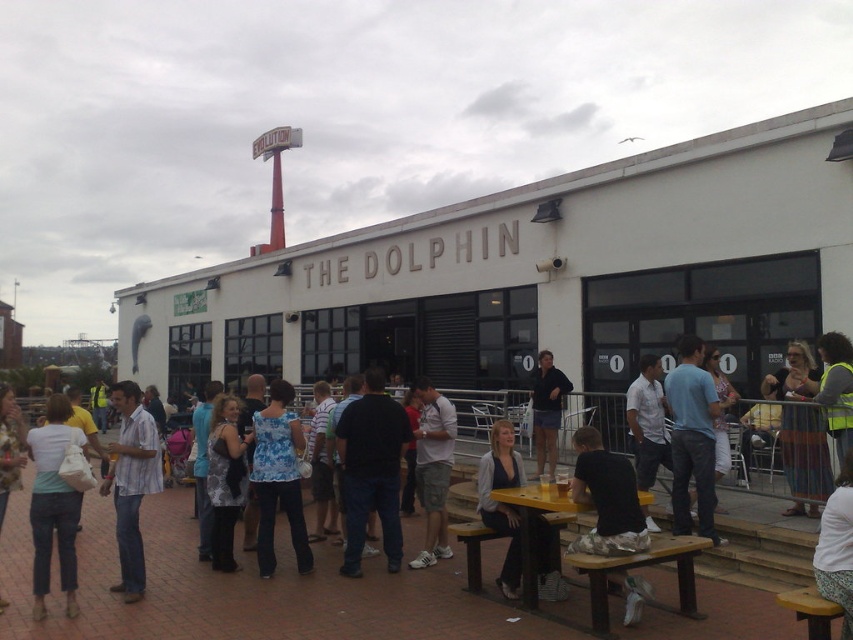
Question: Among these points, which one is nearest to the camera?

Choices:
 (A) (120, 400)
 (B) (514, 531)
 (C) (438, 476)
 (D) (238, 464)

Answer: (B)

Question: Considering the relative positions of dark blue jeans at center and blue cotton shirt at center in the image provided, where is dark blue jeans at center located with respect to blue cotton shirt at center?

Choices:
 (A) left
 (B) right

Answer: (A)

Question: Does white fabric skirt at lower right have a lesser width compared to denim jacket at lower left?

Choices:
 (A) no
 (B) yes

Answer: (B)

Question: Which point appears closest to the camera in this image?

Choices:
 (A) click(x=422, y=384)
 (B) click(x=494, y=493)

Answer: (B)

Question: Which of these objects is positioned closest to the blue printed blouse at center?

Choices:
 (A) wooden picnic table at lower center
 (B) white fabric skirt at lower right

Answer: (A)

Question: Can you confirm if striped cotton shirt at center is positioned below patterned fabric dress at center?

Choices:
 (A) yes
 (B) no

Answer: (A)